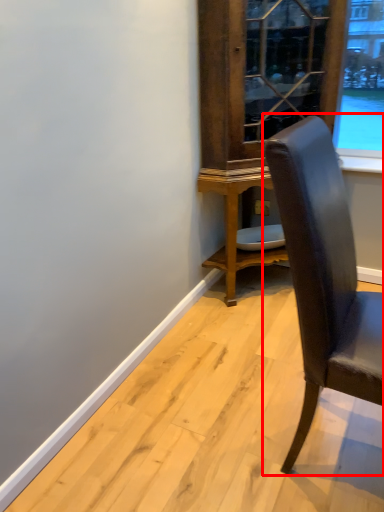
Question: From the image's perspective, where is chair (annotated by the red box) located relative to dresser?

Choices:
 (A) above
 (B) below

Answer: (B)